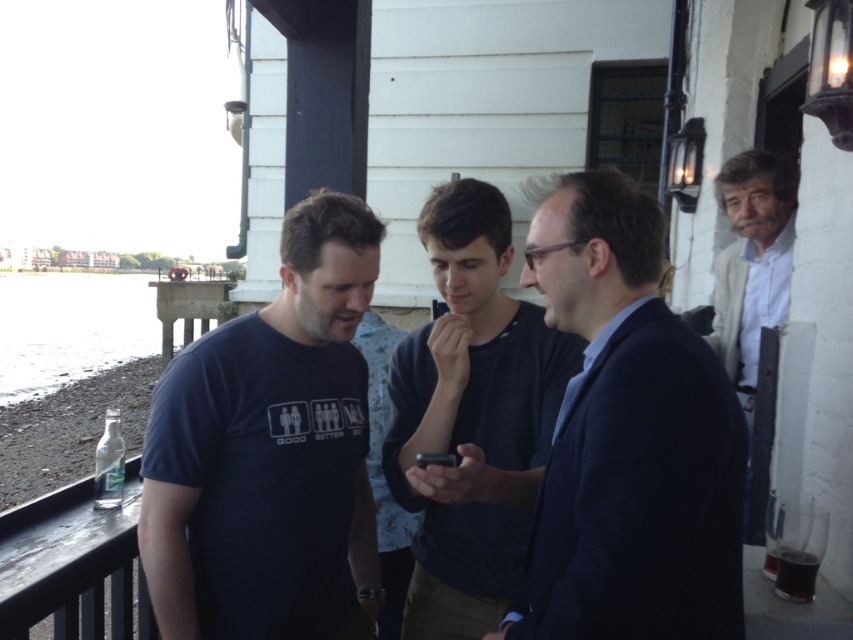
You are a GUI agent. You are given a task and a screenshot of the screen. Output one action in this format:
    pyautogui.click(x=<x>, y=<y>)
    Task: Click on the dark blue suit at center
    
    Given the screenshot: What is the action you would take?
    pyautogui.click(x=628, y=436)

Does dark blue suit at center have a greater width compared to white matte shirt at upper right?

Indeed, dark blue suit at center has a greater width compared to white matte shirt at upper right.

What do you see at coordinates (628, 436) in the screenshot? The width and height of the screenshot is (853, 640). I see `dark blue suit at center` at bounding box center [628, 436].

Identify the location of dark blue suit at center. (628, 436).

Can you confirm if dark blue t-shirt at center is taller than dark blue shirt at center?

In fact, dark blue t-shirt at center may be shorter than dark blue shirt at center.

Who is shorter, dark blue t-shirt at center or dark blue shirt at center?

dark blue t-shirt at center

The image size is (853, 640). Describe the element at coordinates (270, 452) in the screenshot. I see `dark blue t-shirt at center` at that location.

Find the location of a particular element. dark blue t-shirt at center is located at coordinates (270, 452).

The width and height of the screenshot is (853, 640). Identify the location of dark blue t-shirt at center. (270, 452).

Is point (271, 378) closer to viewer compared to point (728, 323)?

Yes, point (271, 378) is in front of point (728, 323).

I want to click on dark blue t-shirt at center, so click(x=270, y=452).